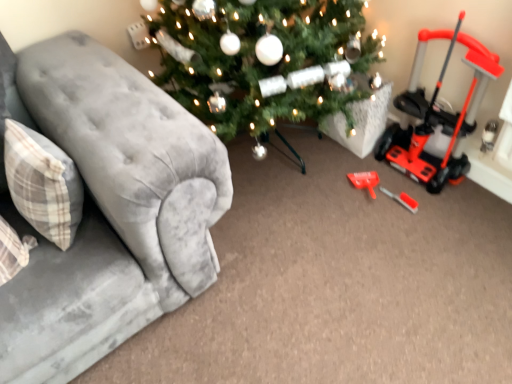
Question: Is orange plastic push mower at right in front of or behind velvet gray couch at left in the image?

Choices:
 (A) front
 (B) behind

Answer: (B)

Question: Based on their positions, is orange plastic push mower at right located to the left or right of velvet gray couch at left?

Choices:
 (A) left
 (B) right

Answer: (B)

Question: Which object is positioned closest to the orange plastic push mower at right?

Choices:
 (A) plaid fabric pillow at left
 (B) velvet gray couch at left
 (C) red plastic screwdriver at lower right

Answer: (C)

Question: Considering the real-world distances, which object is farthest from the red plastic screwdriver at lower right?

Choices:
 (A) plaid fabric pillow at left
 (B) velvet gray couch at left
 (C) orange plastic push mower at right

Answer: (A)